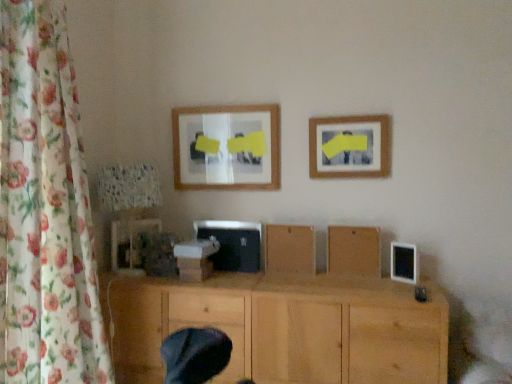
Question: Is matte plastic picture frame at lower left, which is counted as the third picture frame, starting from the top, in front of or behind brown matte wood at center, acting as the third wood starting from the bottom, in the image?

Choices:
 (A) behind
 (B) front

Answer: (A)

Question: Looking at the image, does matte plastic picture frame at lower left, which is the 3th picture frame in right-to-left order, seem bigger or smaller compared to brown matte wood at center, the first wood viewed from the top?

Choices:
 (A) big
 (B) small

Answer: (A)

Question: Which object is the closest to the matte wooden picture frame at upper center, the third picture frame in the bottom-to-top sequence?

Choices:
 (A) wooden board at center, the 2th wood in the top-to-bottom sequence
 (B) natural wood cabinet at center, the 1th wood in the bottom-to-top sequence
 (C) brown matte wood at center, acting as the third wood starting from the bottom
 (D) floral fabric curtain at left
 (E) wooden picture frame at upper right, which is the first picture frame from right to left

Answer: (E)

Question: Which of these objects is positioned farthest from the matte plastic picture frame at lower left, the first picture frame viewed from the left?

Choices:
 (A) floral fabric curtain at left
 (B) wooden board at center, marked as the 2th wood in a bottom-to-top arrangement
 (C) natural wood cabinet at center, arranged as the third wood when viewed from the top
 (D) brown matte wood at center, the first wood viewed from the top
 (E) wooden picture frame at upper right, which is counted as the second picture frame, starting from the bottom

Answer: (E)